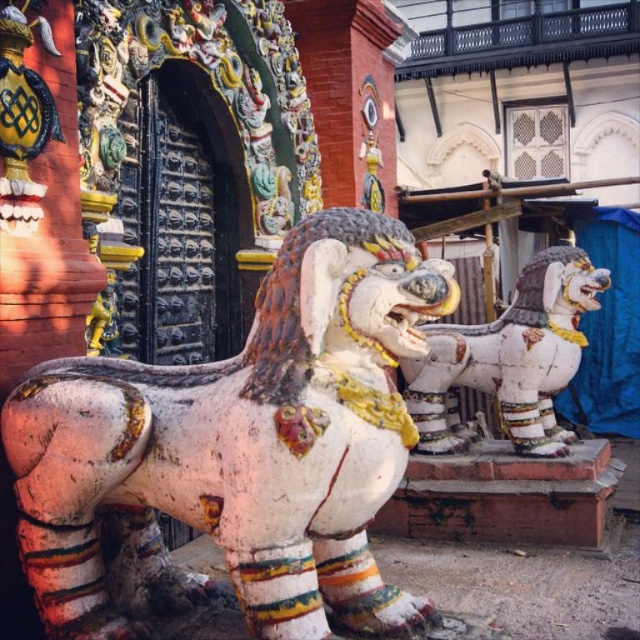
Question: Which of the following is the closest to the observer?

Choices:
 (A) (349, 580)
 (B) (529, 410)

Answer: (A)

Question: Which of the following is the closest to the observer?

Choices:
 (A) (548, 342)
 (B) (19, 404)

Answer: (B)

Question: Does painted wood lion at center have a lesser width compared to white painted stone lion at center?

Choices:
 (A) yes
 (B) no

Answer: (B)

Question: Is painted wood lion at center above white painted stone lion at center?

Choices:
 (A) yes
 (B) no

Answer: (B)

Question: Does painted wood lion at center have a smaller size compared to white painted stone lion at center?

Choices:
 (A) no
 (B) yes

Answer: (B)